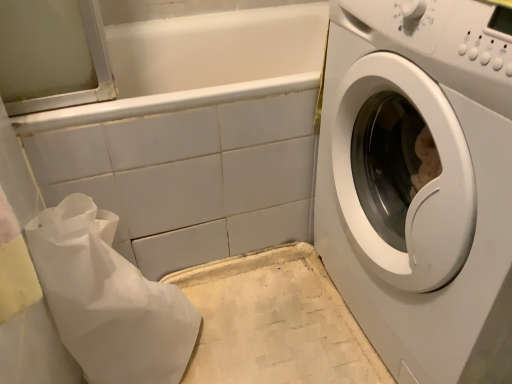
Question: Is white glossy washing machine at right looking in the opposite direction of white glossy bathtub at upper center?

Choices:
 (A) yes
 (B) no

Answer: (B)

Question: Are white glossy washing machine at right and white glossy bathtub at upper center located far from each other?

Choices:
 (A) no
 (B) yes

Answer: (A)

Question: Can you confirm if white glossy washing machine at right is shorter than white glossy bathtub at upper center?

Choices:
 (A) yes
 (B) no

Answer: (B)

Question: Is white glossy washing machine at right positioned in front of white glossy bathtub at upper center?

Choices:
 (A) no
 (B) yes

Answer: (B)

Question: From the image's perspective, would you say white glossy washing machine at right is positioned over white glossy bathtub at upper center?

Choices:
 (A) no
 (B) yes

Answer: (A)

Question: Considering their positions, is white glossy bathtub at upper center located in front of or behind white paper bag at lower left?

Choices:
 (A) front
 (B) behind

Answer: (B)

Question: Is white glossy bathtub at upper center inside or outside of white paper bag at lower left?

Choices:
 (A) outside
 (B) inside

Answer: (A)

Question: From a real-world perspective, is white glossy bathtub at upper center positioned above or below white paper bag at lower left?

Choices:
 (A) above
 (B) below

Answer: (A)

Question: Considering the positions of point (68, 152) and point (50, 283), is point (68, 152) closer or farther from the camera than point (50, 283)?

Choices:
 (A) closer
 (B) farther

Answer: (B)

Question: From their relative heights in the image, would you say white glossy washing machine at right is taller or shorter than white paper bag at lower left?

Choices:
 (A) short
 (B) tall

Answer: (B)

Question: Based on their sizes in the image, would you say white glossy washing machine at right is bigger or smaller than white paper bag at lower left?

Choices:
 (A) big
 (B) small

Answer: (A)

Question: In the image, is white glossy washing machine at right positioned in front of or behind white paper bag at lower left?

Choices:
 (A) behind
 (B) front

Answer: (B)

Question: From a real-world perspective, is white glossy washing machine at right positioned above or below white paper bag at lower left?

Choices:
 (A) above
 (B) below

Answer: (A)

Question: Does point (120, 208) appear closer or farther from the camera than point (435, 375)?

Choices:
 (A) farther
 (B) closer

Answer: (A)

Question: From the image's perspective, is white glossy bathtub at upper center located above or below white glossy washing machine at right?

Choices:
 (A) above
 (B) below

Answer: (A)